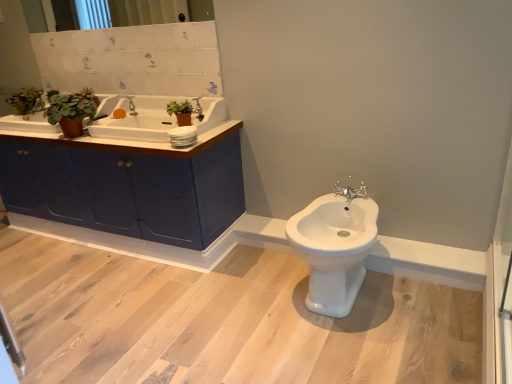
Question: Considering the relative sizes of white glossy bidet at center and silver metallic tap at center, acting as the 2th tap starting from the top, in the image provided, is white glossy bidet at center smaller than silver metallic tap at center, acting as the 2th tap starting from the top,?

Choices:
 (A) yes
 (B) no

Answer: (B)

Question: From the image's perspective, does white glossy bidet at center appear higher than silver metallic tap at center, acting as the 2th tap starting from the top?

Choices:
 (A) yes
 (B) no

Answer: (B)

Question: Is white glossy bidet at center facing away from silver metallic tap at center, acting as the 2th tap starting from the top?

Choices:
 (A) no
 (B) yes

Answer: (A)

Question: Considering the relative sizes of white glossy bidet at center and silver metallic tap at center, acting as the 2th tap starting from the top, in the image provided, is white glossy bidet at center wider than silver metallic tap at center, acting as the 2th tap starting from the top,?

Choices:
 (A) no
 (B) yes

Answer: (B)

Question: Are white glossy bidet at center and silver metallic tap at center, acting as the 2th tap starting from the top, far apart?

Choices:
 (A) no
 (B) yes

Answer: (A)

Question: Does white glossy bidet at center appear on the right side of silver metallic tap at center, the 2th tap in the left-to-right sequence?

Choices:
 (A) yes
 (B) no

Answer: (B)

Question: Is white glossy bidet at center shorter than clear glass mirror at upper center?

Choices:
 (A) yes
 (B) no

Answer: (B)

Question: Is white glossy bidet at center positioned with its back to clear glass mirror at upper center?

Choices:
 (A) no
 (B) yes

Answer: (A)

Question: Considering the relative positions of white glossy bidet at center and clear glass mirror at upper center in the image provided, is white glossy bidet at center to the left of clear glass mirror at upper center from the viewer's perspective?

Choices:
 (A) yes
 (B) no

Answer: (B)

Question: From the image's perspective, is white glossy bidet at center on clear glass mirror at upper center?

Choices:
 (A) yes
 (B) no

Answer: (B)

Question: Is white glossy bidet at center oriented towards clear glass mirror at upper center?

Choices:
 (A) yes
 (B) no

Answer: (B)

Question: Is white glossy bidet at center positioned in front of clear glass mirror at upper center?

Choices:
 (A) no
 (B) yes

Answer: (B)

Question: Can you confirm if white ceramic sink at upper left is positioned to the left of silver metallic tap at center, positioned as the first tap in right-to-left order?

Choices:
 (A) no
 (B) yes

Answer: (B)